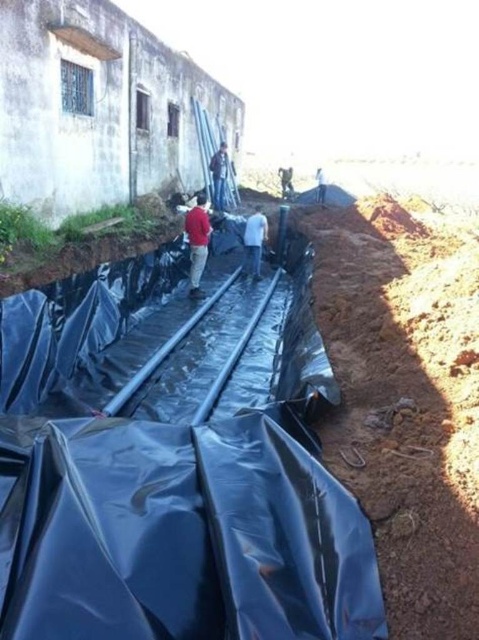
You are a construction worker in the scene and need to place a tool box on the ground. The tool box is the same size as the blue jeans at center. Can you fit the tool box on the white fabric bag at center?

The blue jeans at center is smaller than the white fabric bag at center, so the tool box can fit on the white fabric bag at center since it is larger than the tool box.

You are standing in the outdoor scene and want to move from the point closer to you to the point further away. Which path would you take between the two points, point (218, 209) and point (320, 177)?

You should move from point (218, 209) to point (320, 177) because point (218, 209) is closer to the viewer and the other point is further away.